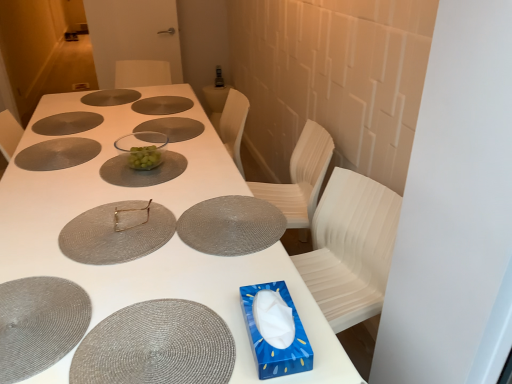
Where is `vacant space behind matte gray glass plate at upper left, which is the 5th glass plate in back-to-front order`? This screenshot has height=384, width=512. vacant space behind matte gray glass plate at upper left, which is the 5th glass plate in back-to-front order is located at coordinates (96, 125).